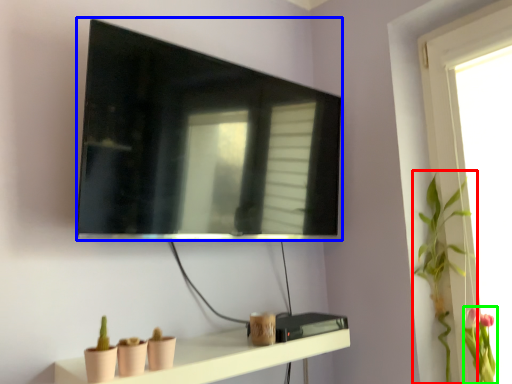
Question: Which is farther away from plant (highlighted by a red box)? television (highlighted by a blue box) or floral arrangement (highlighted by a green box)?

Choices:
 (A) television
 (B) floral arrangement

Answer: (A)